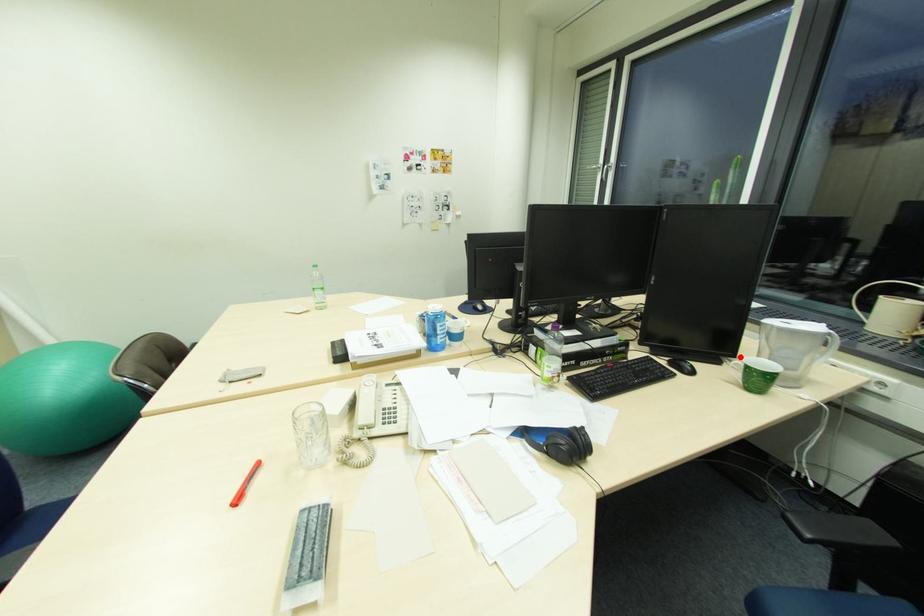
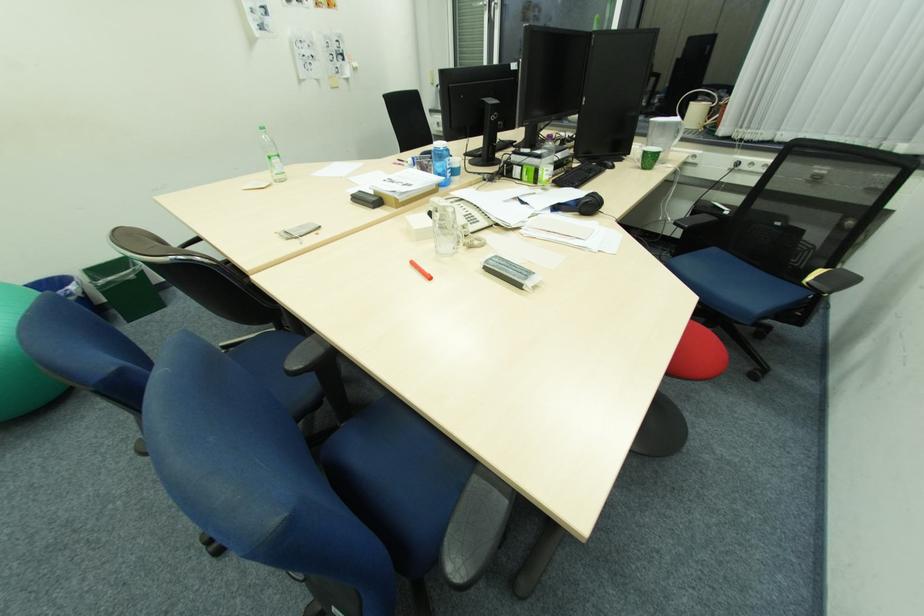
Question: I am providing you with two images of the same scene from different viewpoints. A red point is marked on the first image. Can you still see the location of the red point in image 2?

Choices:
 (A) Yes
 (B) No

Answer: (A)